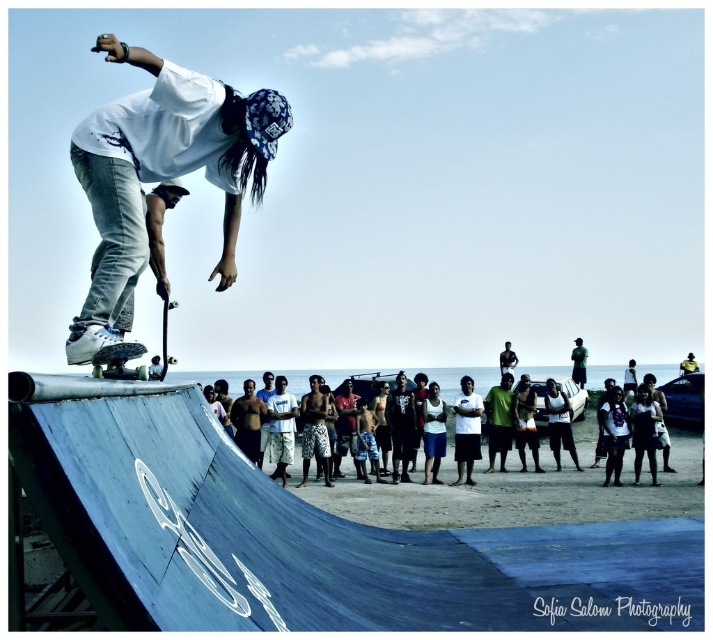
Question: Which point is closer to the camera?

Choices:
 (A) (98, 376)
 (B) (153, 356)
 (C) (284, 392)
 (D) (145, 128)

Answer: (A)

Question: Can you confirm if white matte skateboard at center is positioned above dark brown woven fabric shirt at center?

Choices:
 (A) no
 (B) yes

Answer: (B)

Question: Among these points, which one is farthest from the camera?

Choices:
 (A) (188, 372)
 (B) (133, 278)
 (C) (260, 454)

Answer: (A)

Question: Which of the following is the farthest from the observer?

Choices:
 (A) (125, 516)
 (B) (120, 44)

Answer: (B)

Question: Can you confirm if white cotton shirt at center is thinner than smooth black skateboard at center?

Choices:
 (A) no
 (B) yes

Answer: (B)

Question: Is white cotton shirt at center behind smooth black skateboard at center?

Choices:
 (A) no
 (B) yes

Answer: (B)